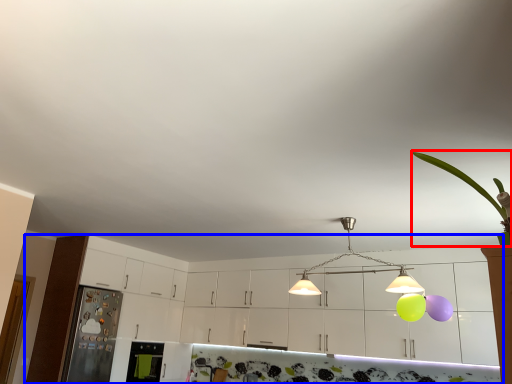
Question: Which object appears closest to the camera in this image, plant (highlighted by a red box) or cabinetry (highlighted by a blue box)?

Choices:
 (A) plant
 (B) cabinetry

Answer: (A)